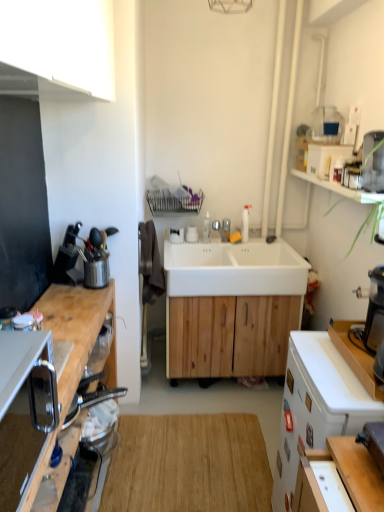
Locate an element on the screen. free spot below natural wood cutting board at center (from a real-world perspective) is located at coordinates (192, 453).